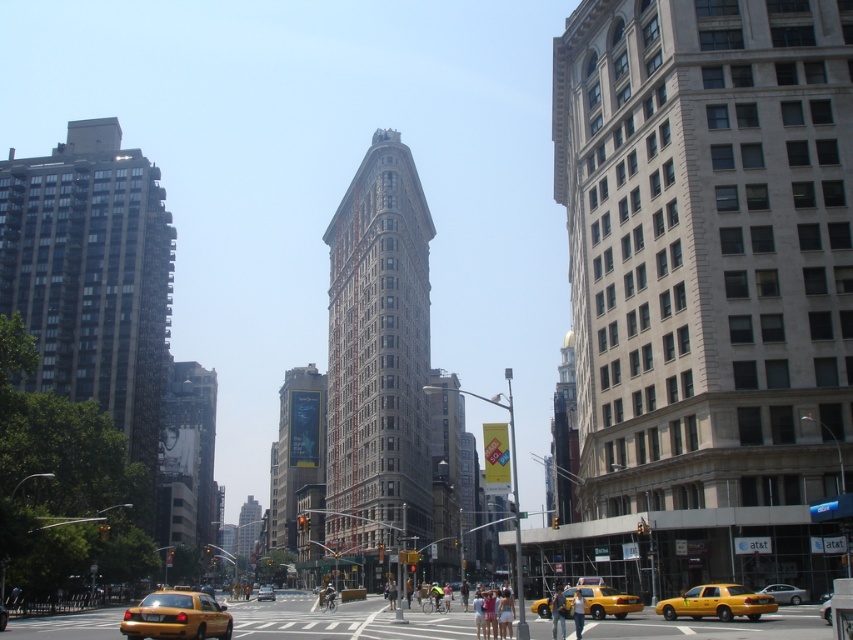
You are a photographer standing at the crosswalk in the scene. You want to take a photo of both the yellow rubber taxi at lower left and the yellow metallic taxi cab at center so that both are fully visible in the frame. Which taxi should you position closer to the camera to ensure both are visible without cropping?

You should position the yellow rubber taxi at lower left closer to the camera because it is shorter than the yellow metallic taxi cab at center. This way, the taller taxi won t block the view of the shorter one when both are in the frame.

You are standing at the crosswalk in the bustling urban scene and want to take a photo of the two points mentioned. Which point, point (198, 627) or point (761, 593), will appear larger in your camera view?

Point (198, 627) will appear larger in your camera view because it is closer to the viewer than point (761, 593).

Looking at this image, you are standing at the crosswalk in the center of the image. Which direction should you walk to reach the yellow matte taxi at lower right?

You should walk towards the lower right direction to reach the yellow matte taxi at lower right, as it is located at point (717,602) which is in the lower right area of the image.